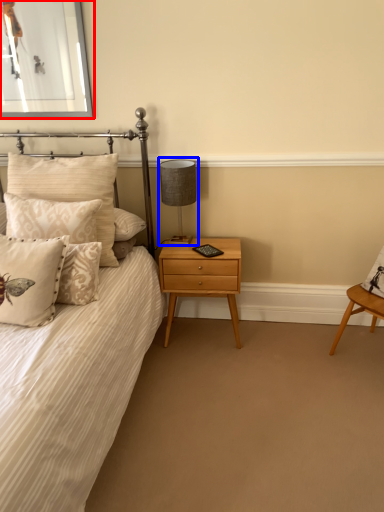
Question: Which of the following is the closest to the observer, picture frame (highlighted by a red box) or table lamp (highlighted by a blue box)?

Choices:
 (A) picture frame
 (B) table lamp

Answer: (A)